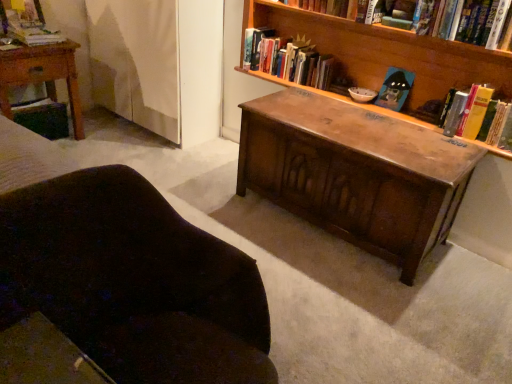
Question: Is wooden bookshelf at upper center, which is the 2th book in left-to-right order, oriented towards wooden bookcase at center?

Choices:
 (A) no
 (B) yes

Answer: (B)

Question: Is wooden bookshelf at upper center, positioned as the 5th book in right-to-left order, further to camera compared to wooden bookcase at center?

Choices:
 (A) no
 (B) yes

Answer: (B)

Question: Does wooden bookshelf at upper center, which is the 2th book in left-to-right order, appear on the right side of wooden bookcase at center?

Choices:
 (A) no
 (B) yes

Answer: (A)

Question: Is the depth of wooden bookshelf at upper center, positioned as the 5th book in right-to-left order, less than that of wooden bookcase at center?

Choices:
 (A) yes
 (B) no

Answer: (B)

Question: Considering the relative sizes of wooden bookshelf at upper center, positioned as the 5th book in right-to-left order, and wooden bookcase at center in the image provided, is wooden bookshelf at upper center, positioned as the 5th book in right-to-left order, smaller than wooden bookcase at center?

Choices:
 (A) no
 (B) yes

Answer: (B)

Question: From the image's perspective, is wooden bookshelf at upper center, positioned as the 5th book in right-to-left order, over wooden bookcase at center?

Choices:
 (A) yes
 (B) no

Answer: (A)

Question: Considering the relative positions of wooden nightstand at left and hardcover book at upper center, the third book from the left, in the image provided, is wooden nightstand at left in front of hardcover book at upper center, the third book from the left,?

Choices:
 (A) yes
 (B) no

Answer: (B)

Question: Does wooden nightstand at left have a larger size compared to hardcover book at upper center, which ranks as the fourth book in right-to-left order?

Choices:
 (A) no
 (B) yes

Answer: (B)

Question: Considering the relative sizes of wooden nightstand at left and hardcover book at upper center, the third book from the left, in the image provided, is wooden nightstand at left smaller than hardcover book at upper center, the third book from the left,?

Choices:
 (A) no
 (B) yes

Answer: (A)

Question: Does wooden nightstand at left have a greater height compared to hardcover book at upper center, the third book from the left?

Choices:
 (A) yes
 (B) no

Answer: (A)

Question: Is wooden nightstand at left far from hardcover book at upper center, the third book from the left?

Choices:
 (A) yes
 (B) no

Answer: (A)

Question: From a real-world perspective, is wooden nightstand at left physically below hardcover book at upper center, the third book from the left?

Choices:
 (A) yes
 (B) no

Answer: (A)

Question: Is yellow paperback book at right, the first book when ordered from right to left, located outside yellow hardcover book at right, which is counted as the second book, starting from the right?

Choices:
 (A) yes
 (B) no

Answer: (A)